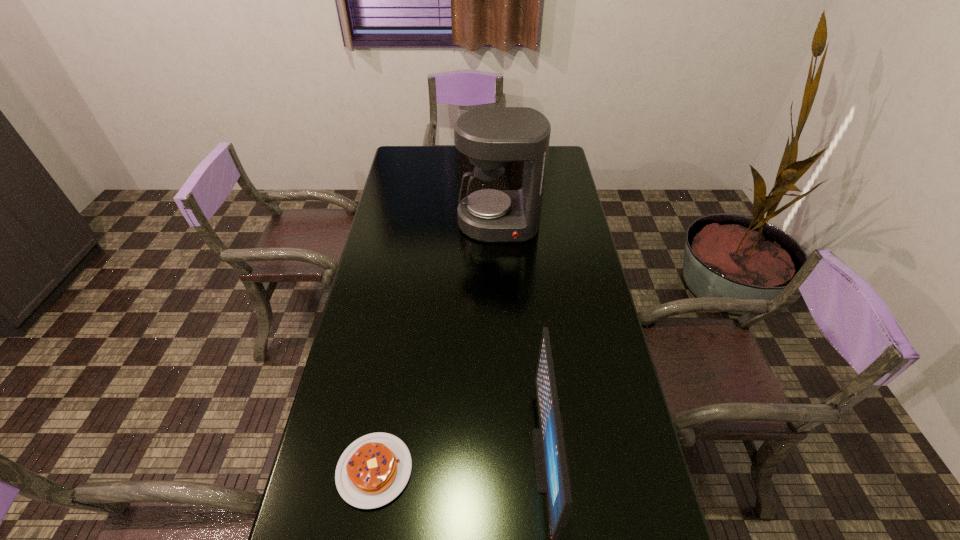
Find the location of a particular element. coffee maker is located at coordinates (491, 137).

The width and height of the screenshot is (960, 540). Identify the location of the farthest object. (491, 137).

Locate an element on the screen. the leftmost object is located at coordinates (373, 470).

Locate an element on the screen. pancake is located at coordinates (373, 470).

Where is `free region located on the button side of the farthest object`? This screenshot has height=540, width=960. free region located on the button side of the farthest object is located at coordinates (503, 322).

Locate an element on the screen. vacant region located 0.340m on the back of the pancake is located at coordinates (398, 328).

I want to click on object located at the left edge, so click(x=373, y=470).

In the image, there is a desktop. Find the location of `free space at the far edge`. free space at the far edge is located at coordinates (454, 163).

The image size is (960, 540). I want to click on free space at the left edge of the desktop, so click(x=381, y=299).

This screenshot has height=540, width=960. In the image, there is a desktop. What are the coordinates of `vacant area at the right edge` in the screenshot? It's located at (586, 279).